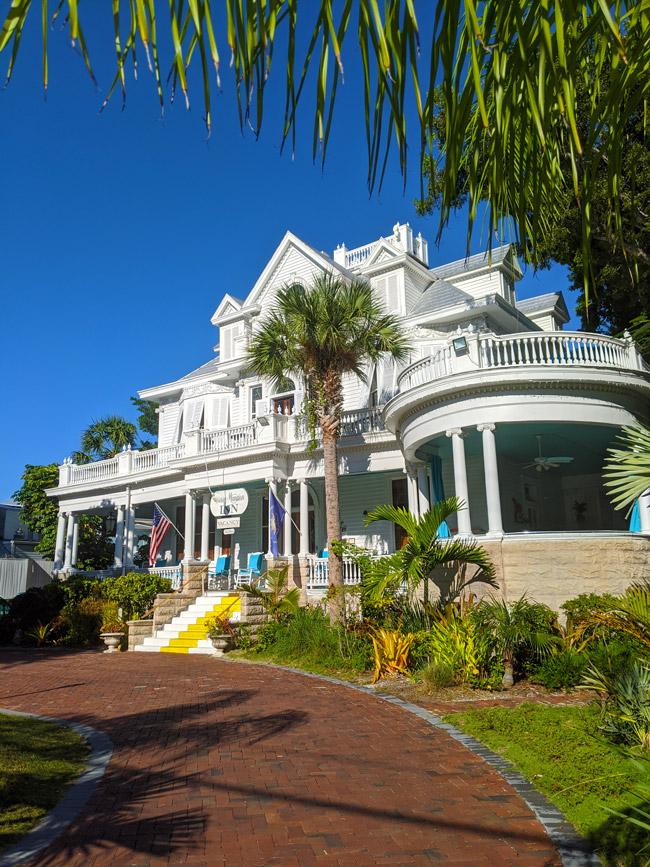
I want to click on white ceiling fan, so click(x=558, y=459).